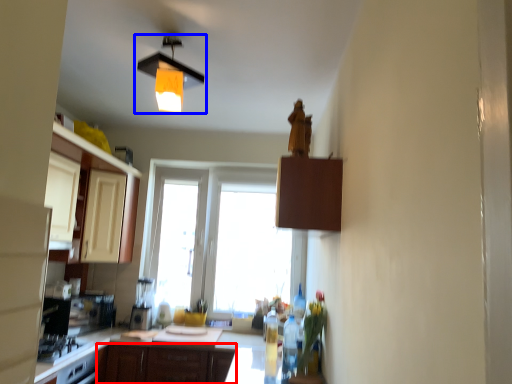
Question: Which point is closer to the camera, cabinetry (highlighted by a red box) or lamp (highlighted by a blue box)?

Choices:
 (A) cabinetry
 (B) lamp

Answer: (B)